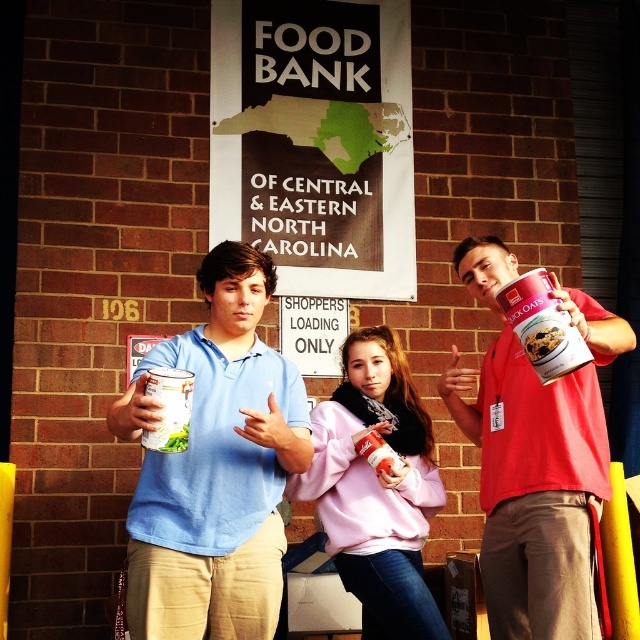
Which of these two, matte blue shirt at center or matte red can at center, stands shorter?

Standing shorter between the two is matte red can at center.

Can you confirm if matte blue shirt at center is wider than matte red can at center?

Indeed, matte blue shirt at center has a greater width compared to matte red can at center.

Between point (124, 401) and point (509, 547), which one is positioned behind?

Positioned behind is point (509, 547).

You are a GUI agent. You are given a task and a screenshot of the screen. Output one action in this format:
    pyautogui.click(x=<x>, y=<y>)
    Task: Click on the matte blue shirt at center
    The height and width of the screenshot is (640, 640).
    Given the screenshot: What is the action you would take?
    pyautogui.click(x=216, y=467)

Can you confirm if pink fleece sweater at center is smaller than matte plastic can at right?

Actually, pink fleece sweater at center might be larger than matte plastic can at right.

Is pink fleece sweater at center shorter than matte plastic can at right?

Incorrect, pink fleece sweater at center's height does not fall short of matte plastic can at right's.

Measure the distance between point (358,340) and camera.

They are 30.46 feet apart.

You are a GUI agent. You are given a task and a screenshot of the screen. Output one action in this format:
    pyautogui.click(x=<x>, y=<y>)
    Task: Click on the pink fleece sweater at center
    The height and width of the screenshot is (640, 640).
    Given the screenshot: What is the action you would take?
    pyautogui.click(x=376, y=488)

Based on the photo, does matte black sign at center have a lesser height compared to matte plastic can at right?

Incorrect, matte black sign at center's height does not fall short of matte plastic can at right's.

How much distance is there between matte black sign at center and matte plastic can at right?

matte black sign at center and matte plastic can at right are 16.80 feet apart.

Who is more forward, (400, 300) or (529, 316)?

Point (529, 316) is in front.

Where is `matte black sign at center`? This screenshot has height=640, width=640. matte black sign at center is located at coordinates (316, 141).